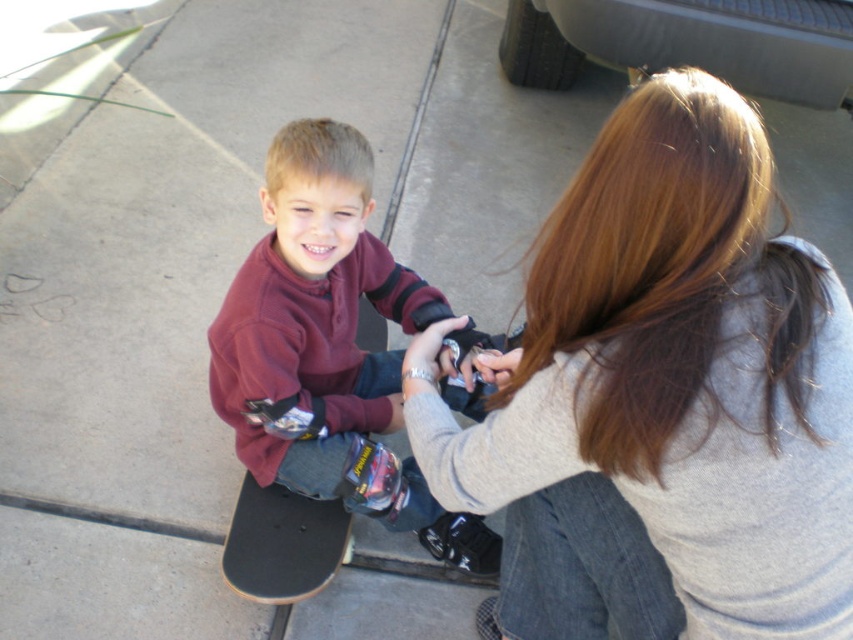
Image resolution: width=853 pixels, height=640 pixels. Describe the element at coordinates (172, 250) in the screenshot. I see `smooth concrete skateboard at center` at that location.

What do you see at coordinates (172, 250) in the screenshot? This screenshot has height=640, width=853. I see `smooth concrete skateboard at center` at bounding box center [172, 250].

You are a GUI agent. You are given a task and a screenshot of the screen. Output one action in this format:
    pyautogui.click(x=<x>, y=<y>)
    Task: Click on the smooth concrete skateboard at center
    This screenshot has width=853, height=640.
    Given the screenshot: What is the action you would take?
    pyautogui.click(x=172, y=250)

Which is below, smooth gray sweater at center or smooth concrete skateboard at center?

smooth gray sweater at center

Is point (445, 474) more distant than point (190, 522)?

That is False.

Identify the location of smooth gray sweater at center. The width and height of the screenshot is (853, 640). (662, 397).

Is the position of smooth gray sweater at center more distant than that of black smooth skateboard at center?

No, it is not.

Does point (614, 506) come behind point (312, 586)?

That is False.

Image resolution: width=853 pixels, height=640 pixels. What are the coordinates of `smooth gray sweater at center` in the screenshot? It's located at (662, 397).

Find the location of a particular element. This screenshot has width=853, height=640. smooth gray sweater at center is located at coordinates (662, 397).